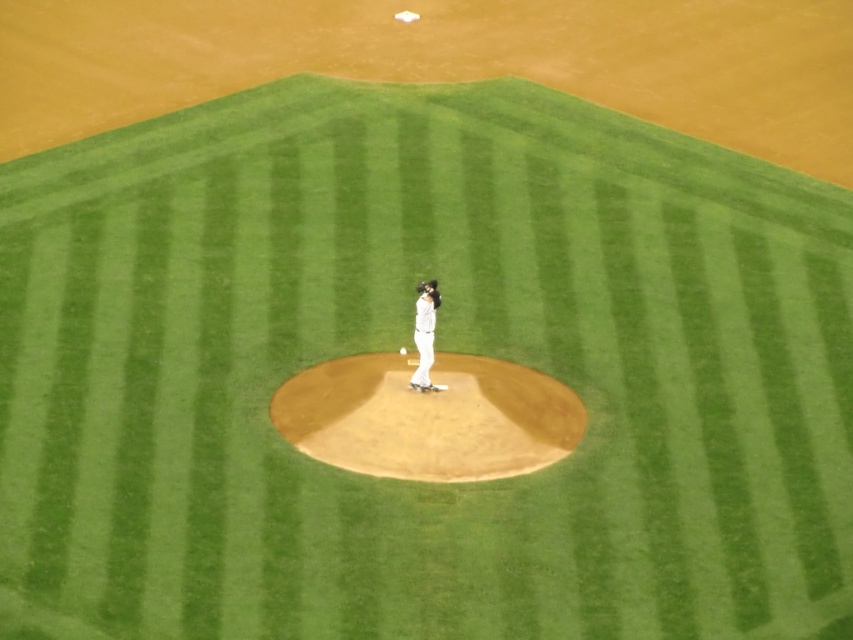
You are a baseball player standing at home plate, which is 15 meters away from the pitcher. You see the dark brown leather glove at center. Can you reach the glove by walking straight from home plate towards it?

The dark brown leather glove at center is 14.98 meters away from the viewer, so yes, you can reach it by walking straight since it is slightly closer than 15 meters.

You are a sports analyst trying to determine the relative sizes of the objects in the image. Based on the scene, which object is wider between the white matte baseball pitcher at center and the white matte baseball at center?

The white matte baseball pitcher at center is wider than the white matte baseball at center.

You are a baseball coach analyzing a player photo. The scene shows the brown dirt mound at center and the dark brown leather glove at center. Which object is wider?

The brown dirt mound at center is wider than the dark brown leather glove at center.